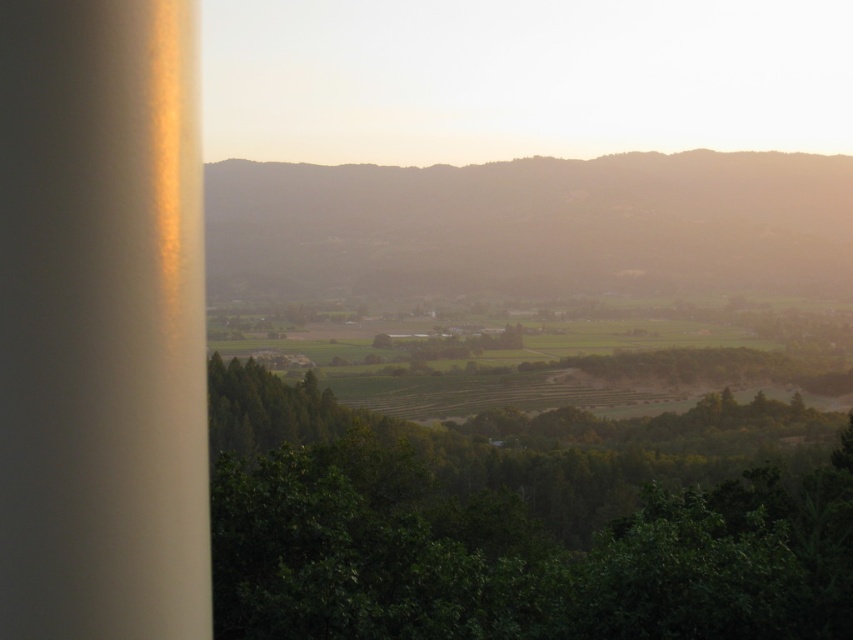
Between green leafy tree at center and green grassy hillside at center, which one is positioned higher?

green grassy hillside at center

Which is more to the left, green leafy tree at center or green grassy hillside at center?

green grassy hillside at center

Image resolution: width=853 pixels, height=640 pixels. What do you see at coordinates (523, 522) in the screenshot?
I see `green leafy tree at center` at bounding box center [523, 522].

Image resolution: width=853 pixels, height=640 pixels. I want to click on green leafy tree at center, so click(x=523, y=522).